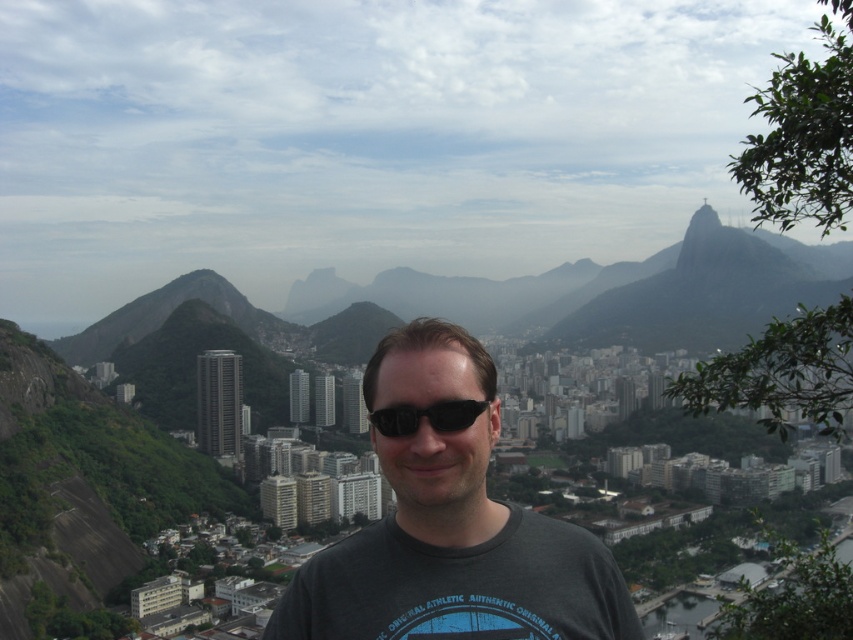
Question: Is dark gray t-shirt at center thinner than black plastic sunglasses at center?

Choices:
 (A) yes
 (B) no

Answer: (B)

Question: Is dark gray t-shirt at center thinner than black plastic sunglasses at center?

Choices:
 (A) no
 (B) yes

Answer: (A)

Question: Does dark gray t-shirt at center appear on the left side of black plastic sunglasses at center?

Choices:
 (A) yes
 (B) no

Answer: (A)

Question: Among these objects, which one is nearest to the camera?

Choices:
 (A) black plastic sunglasses at center
 (B) dark gray t-shirt at center

Answer: (B)